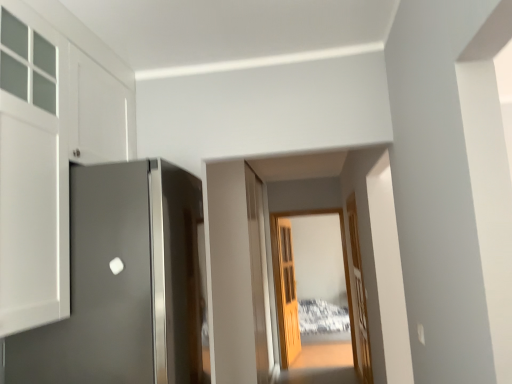
Image resolution: width=512 pixels, height=384 pixels. Describe the element at coordinates (279, 269) in the screenshot. I see `transparent wooden door at center` at that location.

The height and width of the screenshot is (384, 512). I want to click on satin gray door at left, the third door in the back-to-front sequence, so click(x=124, y=283).

Locate an element on the screen. Image resolution: width=512 pixels, height=384 pixels. transparent wooden door at center is located at coordinates (279, 269).

From the image's perspective, is light brown wooden door at center, the 3th door in the front-to-back sequence, beneath satin gray door at left, the third door in the back-to-front sequence?

Correct, light brown wooden door at center, the 3th door in the front-to-back sequence, appears lower than satin gray door at left, the third door in the back-to-front sequence, in the image.

Could you tell me if light brown wooden door at center, marked as the second door in a left-to-right arrangement, is facing satin gray door at left, the third door in the back-to-front sequence?

No, light brown wooden door at center, marked as the second door in a left-to-right arrangement, does not turn towards satin gray door at left, the third door in the back-to-front sequence.

Which is behind, point (297, 319) or point (85, 295)?

The point (297, 319) is more distant.

How many degrees apart are the facing directions of light brown wooden door at center, marked as the second door in a left-to-right arrangement, and satin gray door at left, the third door positioned from the right?

9.02 degrees.

Consider the image. From a real-world perspective, who is located higher, transparent wooden door at center or wooden door at center, the third door from the left?

transparent wooden door at center.

Is transparent wooden door at center positioned before wooden door at center, which is the second door from front to back?

No, it is behind wooden door at center, which is the second door from front to back.

Where is `the 1st door in front of the transparent wooden door at center, starting your count from the anchor`? The image size is (512, 384). the 1st door in front of the transparent wooden door at center, starting your count from the anchor is located at coordinates (358, 298).

Would you say transparent wooden door at center is inside or outside wooden door at center, arranged as the second door when viewed from the back?

transparent wooden door at center is spatially situated outside wooden door at center, arranged as the second door when viewed from the back.

Considering the positions of objects satin gray door at left, the 1th door in the left-to-right sequence, and light brown wooden door at center, the 3th door in the front-to-back sequence, in the image provided, who is behind, satin gray door at left, the 1th door in the left-to-right sequence, or light brown wooden door at center, the 3th door in the front-to-back sequence,?

light brown wooden door at center, the 3th door in the front-to-back sequence, is further away from the camera.

Does point (137, 214) appear closer or farther from the camera than point (298, 349)?

Point (137, 214) is closer to the camera than point (298, 349).

Is satin gray door at left, the third door positioned from the right, touching light brown wooden door at center, the 1th door when ordered from back to front?

No, satin gray door at left, the third door positioned from the right, is not in contact with light brown wooden door at center, the 1th door when ordered from back to front.

From the picture: Could light brown wooden door at center, placed as the second door when sorted from right to left, be considered to be inside satin gray door at left, the 1th door in the front-to-back sequence?

That's incorrect, light brown wooden door at center, placed as the second door when sorted from right to left, is not inside satin gray door at left, the 1th door in the front-to-back sequence.

Identify the location of door behind the transparent wooden door at center. The height and width of the screenshot is (384, 512). (287, 294).

Can you confirm if light brown wooden door at center, marked as the second door in a left-to-right arrangement, is smaller than transparent wooden door at center?

Indeed, light brown wooden door at center, marked as the second door in a left-to-right arrangement, has a smaller size compared to transparent wooden door at center.

Is light brown wooden door at center, placed as the second door when sorted from right to left, positioned behind transparent wooden door at center?

Yes, it is.

Considering the sizes of transparent wooden door at center and satin gray door at left, the 1th door in the front-to-back sequence, in the image, is transparent wooden door at center taller or shorter than satin gray door at left, the 1th door in the front-to-back sequence,?

transparent wooden door at center is taller than satin gray door at left, the 1th door in the front-to-back sequence.

Considering their positions, is transparent wooden door at center located in front of or behind satin gray door at left, the third door in the back-to-front sequence?

transparent wooden door at center is behind satin gray door at left, the third door in the back-to-front sequence.

Does transparent wooden door at center have a larger size compared to satin gray door at left, the 1th door in the front-to-back sequence?

No.

Can you tell me how much wooden door at center, the third door from the left, and light brown wooden door at center, marked as the second door in a left-to-right arrangement, differ in facing direction?

The angle between the facing direction of wooden door at center, the third door from the left, and the facing direction of light brown wooden door at center, marked as the second door in a left-to-right arrangement, is 171 degrees.

Looking at this image, considering the sizes of objects wooden door at center, arranged as the second door when viewed from the back, and light brown wooden door at center, the 3th door in the front-to-back sequence, in the image provided, who is thinner, wooden door at center, arranged as the second door when viewed from the back, or light brown wooden door at center, the 3th door in the front-to-back sequence,?

wooden door at center, arranged as the second door when viewed from the back, is thinner.

Is the position of wooden door at center, the third door from the left, more distant than that of light brown wooden door at center, marked as the second door in a left-to-right arrangement?

No.

Based on the photo, from a real-world perspective, between wooden door at center, which is the second door from front to back, and light brown wooden door at center, the 3th door in the front-to-back sequence, who is vertically higher?

wooden door at center, which is the second door from front to back, from a real-world perspective.

Would you say transparent wooden door at center is part of wooden door at center, the third door from the left,'s contents?

No, transparent wooden door at center is not surrounded by wooden door at center, the third door from the left.

Is wooden door at center, the first door from the right, aimed at transparent wooden door at center?

No, wooden door at center, the first door from the right, is not oriented towards transparent wooden door at center.

Considering the relative sizes of wooden door at center, the third door from the left, and transparent wooden door at center in the image provided, is wooden door at center, the third door from the left, shorter than transparent wooden door at center?

Indeed, wooden door at center, the third door from the left, has a lesser height compared to transparent wooden door at center.

Which of these two, wooden door at center, the third door from the left, or transparent wooden door at center, is wider?

transparent wooden door at center.

Where is `door that is the 2nd object located behind the satin gray door at left, the third door in the back-to-front sequence`? Image resolution: width=512 pixels, height=384 pixels. door that is the 2nd object located behind the satin gray door at left, the third door in the back-to-front sequence is located at coordinates pos(287,294).

Locate an element on the screen. the 1st door above when counting from the transparent wooden door at center (from the image's perspective) is located at coordinates (358, 298).

When comparing their distances from wooden door at center, the third door from the left, does light brown wooden door at center, marked as the second door in a left-to-right arrangement, or satin gray door at left, the 1th door in the left-to-right sequence, seem further?

The object further to wooden door at center, the third door from the left, is satin gray door at left, the 1th door in the left-to-right sequence.

Looking at the image, which one is located further to wooden door at center, the first door from the right, satin gray door at left, the third door positioned from the right, or transparent wooden door at center?

satin gray door at left, the third door positioned from the right, is further to wooden door at center, the first door from the right.

From the image, which object appears to be farther from light brown wooden door at center, the 1th door when ordered from back to front, wooden door at center, which is the second door from front to back, or transparent wooden door at center?

wooden door at center, which is the second door from front to back, lies further to light brown wooden door at center, the 1th door when ordered from back to front, than the other object.

Considering their positions, is transparent wooden door at center positioned further to satin gray door at left, the 1th door in the left-to-right sequence, than wooden door at center, the third door from the left?

transparent wooden door at center is positioned further to the anchor satin gray door at left, the 1th door in the left-to-right sequence.

Considering their positions, is transparent wooden door at center positioned further to wooden door at center, the first door from the right, than light brown wooden door at center, the 1th door when ordered from back to front?

The object further to wooden door at center, the first door from the right, is light brown wooden door at center, the 1th door when ordered from back to front.

Which object lies further to the anchor point satin gray door at left, the 1th door in the front-to-back sequence, wooden door at center, the first door from the right, or transparent wooden door at center?

transparent wooden door at center is further to satin gray door at left, the 1th door in the front-to-back sequence.

Based on their spatial positions, is transparent wooden door at center or wooden door at center, the third door from the left, closer to light brown wooden door at center, the 3th door in the front-to-back sequence?

transparent wooden door at center.

Based on their spatial positions, is satin gray door at left, the third door positioned from the right, or light brown wooden door at center, the 3th door in the front-to-back sequence, closer to transparent wooden door at center?

Based on the image, light brown wooden door at center, the 3th door in the front-to-back sequence, appears to be nearer to transparent wooden door at center.

Find the location of a particular element. glass door positioned between satin gray door at left, the 1th door in the front-to-back sequence, and light brown wooden door at center, the 1th door when ordered from back to front, from near to far is located at coordinates (279, 269).

You are a GUI agent. You are given a task and a screenshot of the screen. Output one action in this format:
    pyautogui.click(x=<x>, y=<y>)
    Task: Click on the glass door positioned between wooden door at center, the third door from the left, and light brown wooden door at center, placed as the second door when sorted from right to left, from near to far
    
    Given the screenshot: What is the action you would take?
    pyautogui.click(x=279, y=269)

This screenshot has width=512, height=384. In order to click on door located between satin gray door at left, the 1th door in the left-to-right sequence, and light brown wooden door at center, marked as the second door in a left-to-right arrangement, in the depth direction in this screenshot , I will do `click(358, 298)`.

In order to click on door between satin gray door at left, the 1th door in the left-to-right sequence, and transparent wooden door at center in the front-back direction in this screenshot , I will do `click(358, 298)`.